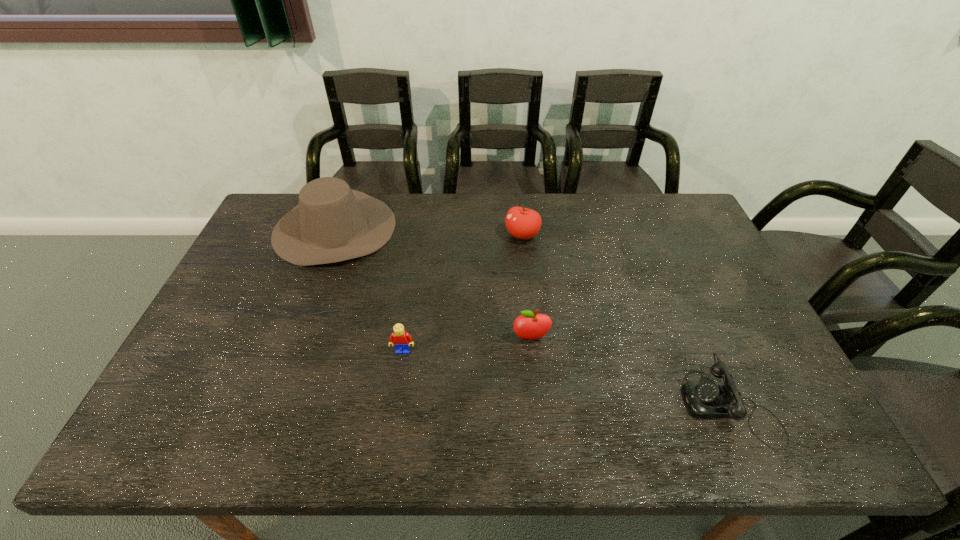
Identify the location of vacant area between the nearer apple and the farther apple. This screenshot has width=960, height=540. (526, 287).

Identify the location of free space that is in between the tallest object and the third nearest object. This screenshot has height=540, width=960. (433, 283).

Where is `unoccupied area between the tallest object and the third nearest object`? unoccupied area between the tallest object and the third nearest object is located at coordinates (433, 283).

Find the location of a particular element. This screenshot has height=540, width=960. vacant area that lies between the shortest object and the second object from left to right is located at coordinates (566, 377).

Locate an element on the screen. vacant area between the leftmost object and the farther apple is located at coordinates (428, 232).

Locate an element on the screen. vacant area between the second nearest object and the leftmost object is located at coordinates (369, 289).

At what (x,y) coordinates should I click in order to perform the action: click on the closest object to the nearer apple. Please return your answer as a coordinate pair (x, y). The height and width of the screenshot is (540, 960). Looking at the image, I should click on 401,340.

Identify the location of object that ranks as the closest to the fourth object from right to left. (529, 325).